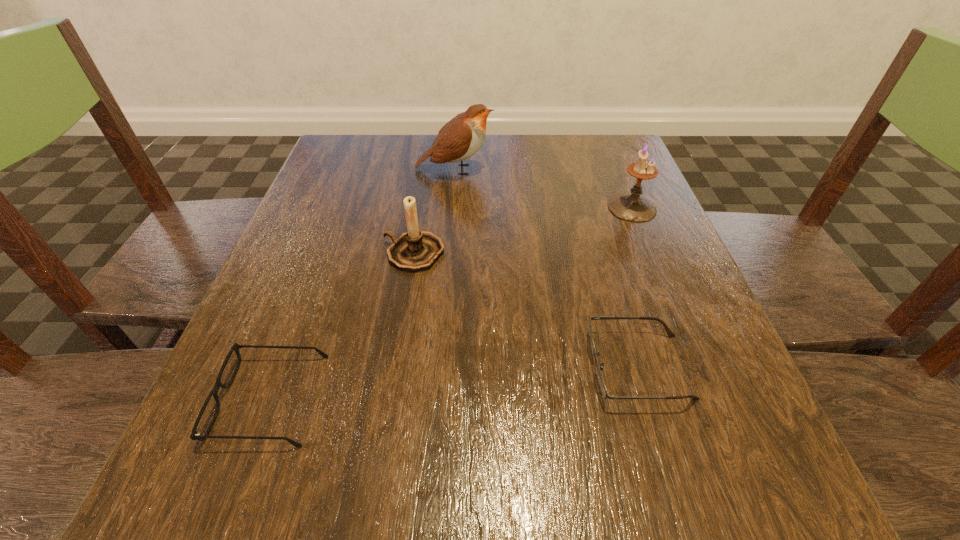
This screenshot has height=540, width=960. What are the coordinates of `free space between the leftmost object and the fourth nearest object` in the screenshot? It's located at (450, 303).

Where is `vacant area that lies between the right candle holder and the right spectacles`? This screenshot has height=540, width=960. vacant area that lies between the right candle holder and the right spectacles is located at coordinates (635, 287).

This screenshot has height=540, width=960. In order to click on free point between the right spectacles and the nearer candle holder in this screenshot , I will do `click(526, 310)`.

This screenshot has height=540, width=960. Identify the location of blank region between the farther candle holder and the bird. (543, 188).

Where is `free space between the nearer candle holder and the left spectacles`? This screenshot has width=960, height=540. free space between the nearer candle holder and the left spectacles is located at coordinates [x=342, y=326].

Locate an element on the screen. This screenshot has height=540, width=960. empty location between the third farthest object and the farthest object is located at coordinates (434, 211).

Find the location of a particular element. This screenshot has height=540, width=960. object that is the fourth closest to the left spectacles is located at coordinates (632, 207).

This screenshot has width=960, height=540. In order to click on object that is the fourth closest one to the right spectacles in this screenshot , I will do [460, 138].

Where is `blank space that satisfies the following two spatial constraints: 1. at the face of the fourth nearest object; 2. on the left side of the bird`? The height and width of the screenshot is (540, 960). blank space that satisfies the following two spatial constraints: 1. at the face of the fourth nearest object; 2. on the left side of the bird is located at coordinates (451, 208).

The height and width of the screenshot is (540, 960). Identify the location of free space that satisfies the following two spatial constraints: 1. on the front-facing side of the farther candle holder; 2. on the left side of the left spectacles. (341, 208).